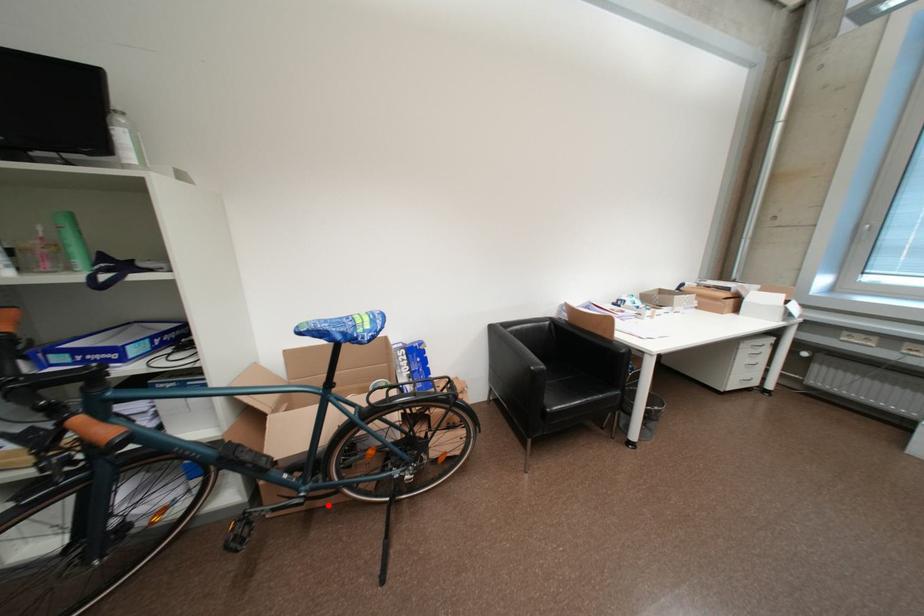
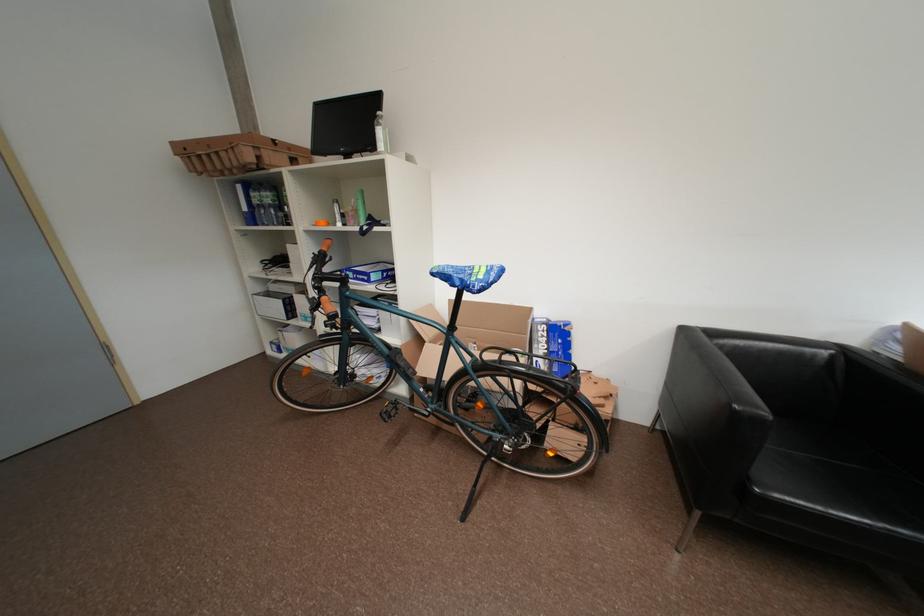
Question: I am providing you with two images of the same scene from different viewpoints. Given a red point in image1, look at the same physical point in image2. Is it:

Choices:
 (A) Closer to the viewpoint
 (B) Farther from the viewpoint

Answer: (B)